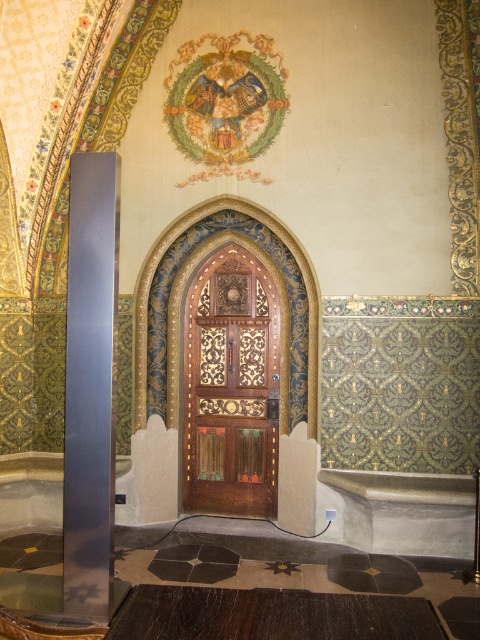
Is wooden carved door at center closer to camera compared to satin silver pole at left?

No, it is not.

Between wooden carved door at center and satin silver pole at left, which one is positioned higher?

satin silver pole at left

Image resolution: width=480 pixels, height=640 pixels. Find the location of `wooden carved door at center`. wooden carved door at center is located at coordinates (230, 387).